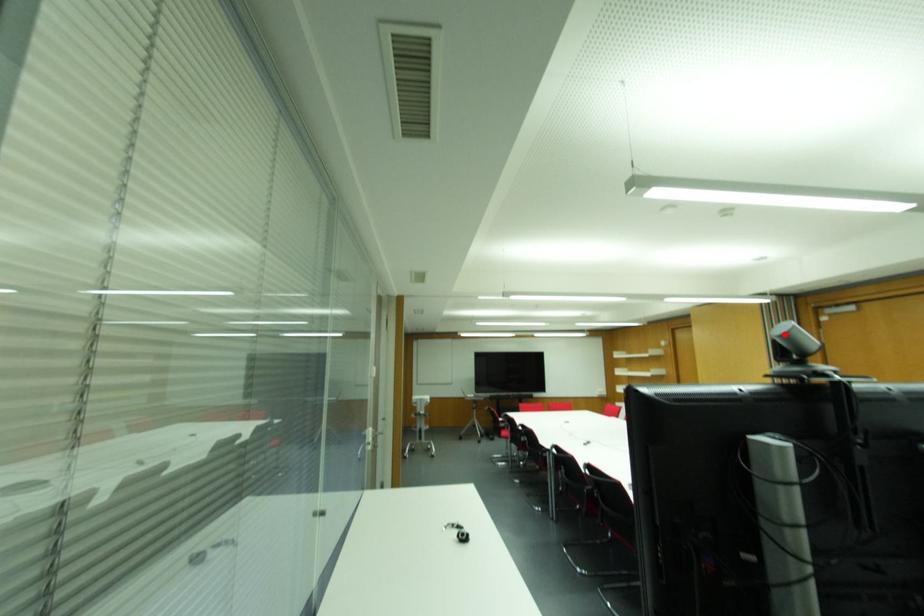
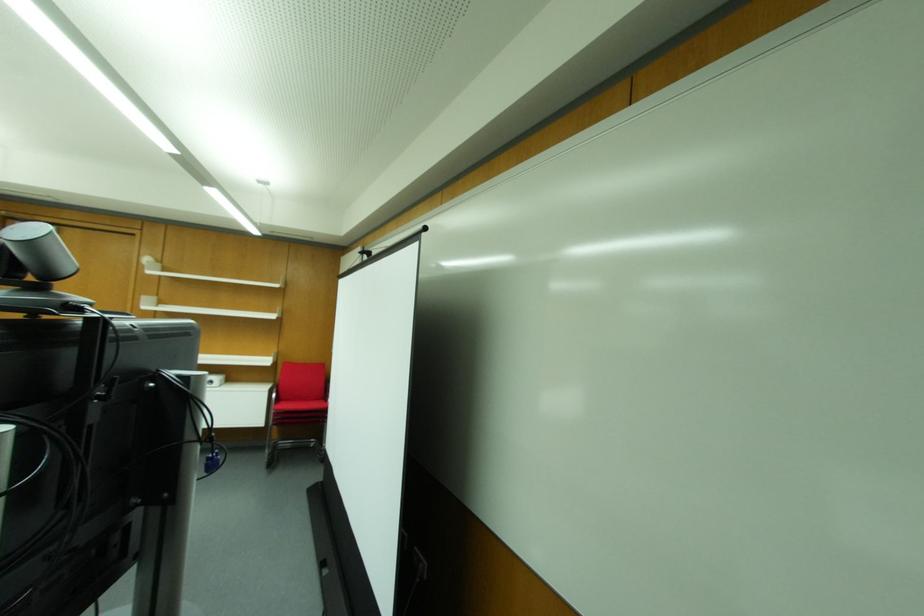
Question: I am providing you with two images of the same scene from different viewpoints. Given a red point in image1, look at the same physical point in image2. Is it:

Choices:
 (A) Closer to the viewpoint
 (B) Farther from the viewpoint

Answer: (B)